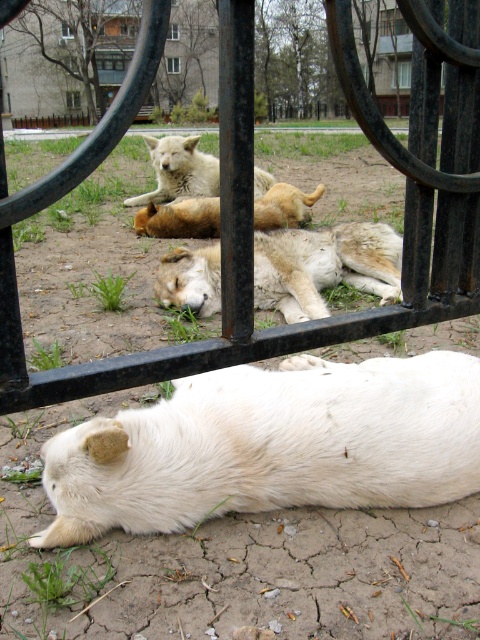
You are a delivery robot trying to pass through the black metal gate at center. The white fur dog at upper center is blocking your path. Can you go through the gate without moving the dog?

The black metal gate at center is wider than the white fur dog at upper center, so yes, you can pass through the gate without moving the dog as there is enough space around the dog.

You are a photographer standing in front of the black metal gate at center. You want to take a photo of the white fur dog at center through the gate. Considering the size of the gate and the dog, will the entire dog fit within the gate frame when you take the picture?

The black metal gate at center has a larger size compared to the white fur dog at center, so the entire dog will fit within the gate frame when taking the picture.